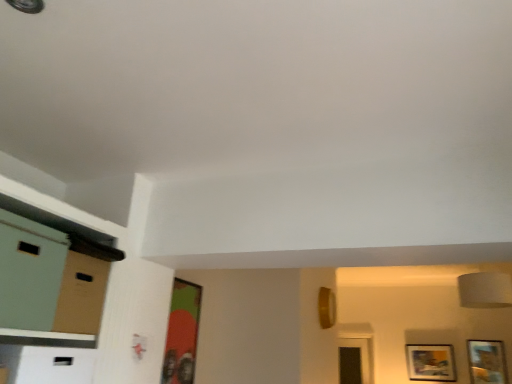
What do you see at coordinates (29, 272) in the screenshot? I see `matte green file cabinet at left` at bounding box center [29, 272].

Locate an element on the screen. The image size is (512, 384). matte cardboard dresser at left is located at coordinates (51, 282).

From a real-world perspective, who is located higher, matte green file cabinet at left or wooden picture frame at lower right, the second picture frame positioned from the right?

matte green file cabinet at left is physically above.

What are the coordinates of `file cabinet in front of the wooden picture frame at lower right, the second picture frame positioned from the right` in the screenshot? It's located at (29, 272).

Can you tell me how much matte green file cabinet at left and wooden picture frame at lower right, arranged as the 1th picture frame when ordered from the bottom, differ in facing direction?

88.4 degrees.

Starting from the matte green file cabinet at left, which picture frame is the 2nd one behind? Please provide its 2D coordinates.

[(487, 362)]

Consider the image. Considering the sizes of objects wooden framed picture at lower right, arranged as the 2th picture frame when viewed from the front, and matte green file cabinet at left in the image provided, who is thinner, wooden framed picture at lower right, arranged as the 2th picture frame when viewed from the front, or matte green file cabinet at left?

With smaller width is wooden framed picture at lower right, arranged as the 2th picture frame when viewed from the front.

In terms of height, does wooden framed picture at lower right, positioned as the 3th picture frame in left-to-right order, look taller or shorter compared to matte green file cabinet at left?

In the image, wooden framed picture at lower right, positioned as the 3th picture frame in left-to-right order, appears to be taller than matte green file cabinet at left.

Is wooden framed picture at lower right, arranged as the 2th picture frame when viewed from the front, outside of matte green file cabinet at left?

Absolutely, wooden framed picture at lower right, arranged as the 2th picture frame when viewed from the front, is external to matte green file cabinet at left.

Between point (485, 342) and point (106, 284), which one is positioned in front?

The point (106, 284) is closer.

Is wooden framed picture at lower right, which is the second picture frame in back-to-front order, looking in the opposite direction of matte cardboard dresser at left?

wooden framed picture at lower right, which is the second picture frame in back-to-front order, is not turned away from matte cardboard dresser at left.

Is wooden framed picture at lower right, positioned as the 2th picture frame in bottom-to-top order, placed right next to matte cardboard dresser at left?

No.

In the image, is wooden framed picture at lower right, positioned as the 2th picture frame in bottom-to-top order, positioned in front of or behind matte cardboard dresser at left?

Clearly, wooden framed picture at lower right, positioned as the 2th picture frame in bottom-to-top order, is behind matte cardboard dresser at left.

Would you say wooden picture frame at lower right, the first picture frame in the back-to-front sequence, is outside matte cardboard dresser at left?

Yes, wooden picture frame at lower right, the first picture frame in the back-to-front sequence, is outside of matte cardboard dresser at left.

Is wooden picture frame at lower right, placed as the 2th picture frame when sorted from left to right, smaller than matte cardboard dresser at left?

Yes.

Considering the sizes of objects wooden picture frame at lower right, which is counted as the 3th picture frame, starting from the front, and matte cardboard dresser at left in the image provided, who is thinner, wooden picture frame at lower right, which is counted as the 3th picture frame, starting from the front, or matte cardboard dresser at left?

With smaller width is wooden picture frame at lower right, which is counted as the 3th picture frame, starting from the front.

How different are the orientations of matte cardboard dresser at left and wooden framed picture at lower right, positioned as the 2th picture frame in bottom-to-top order, in degrees?

There is a 88.4-degree angle between the facing directions of matte cardboard dresser at left and wooden framed picture at lower right, positioned as the 2th picture frame in bottom-to-top order.

Which point is more forward, (6, 294) or (488, 366)?

The point (6, 294) is in front.

Is matte cardboard dresser at left directly adjacent to wooden framed picture at lower right, which is the second picture frame in back-to-front order?

No, matte cardboard dresser at left is not with wooden framed picture at lower right, which is the second picture frame in back-to-front order.

Where is `dresser in front of the wooden framed picture at lower right, positioned as the 3th picture frame in left-to-right order`? This screenshot has width=512, height=384. dresser in front of the wooden framed picture at lower right, positioned as the 3th picture frame in left-to-right order is located at coordinates (51, 282).

There is a matte green file cabinet at left. At what (x,y) coordinates should I click in order to perform the action: click on the 1st picture frame below it (from the image's perspective). Please return your answer as a coordinate pair (x, y). The width and height of the screenshot is (512, 384). Looking at the image, I should click on (182, 333).

From a real-world perspective, is matte green file cabinet at left physically above green matte picture frame at center, the third picture frame from the back?

Yes, from a real-world perspective, matte green file cabinet at left is above green matte picture frame at center, the third picture frame from the back.

Does matte green file cabinet at left come behind green matte picture frame at center, marked as the 1th picture frame in a top-to-bottom arrangement?

No, the depth of matte green file cabinet at left is less than that of green matte picture frame at center, marked as the 1th picture frame in a top-to-bottom arrangement.

Between matte green file cabinet at left and green matte picture frame at center, marked as the 1th picture frame in a top-to-bottom arrangement, which one appears on the right side from the viewer's perspective?

green matte picture frame at center, marked as the 1th picture frame in a top-to-bottom arrangement, is more to the right.

From a real-world perspective, is matte green file cabinet at left physically above matte cardboard dresser at left?

Yes, from a real-world perspective, matte green file cabinet at left is above matte cardboard dresser at left.

Can you confirm if matte green file cabinet at left is smaller than matte cardboard dresser at left?

Incorrect, matte green file cabinet at left is not smaller in size than matte cardboard dresser at left.

From the image's perspective, is matte green file cabinet at left above or below matte cardboard dresser at left?

From the image's perspective, matte green file cabinet at left appears above matte cardboard dresser at left.

There is a matte green file cabinet at left. At what (x,y) coordinates should I click in order to perform the action: click on the 3rd picture frame below it (from a real-world perspective). Please return your answer as a coordinate pair (x, y). The height and width of the screenshot is (384, 512). Looking at the image, I should click on (431, 362).

Where is `the 2nd picture frame behind the matte green file cabinet at left, counting from the anchor's position`? The height and width of the screenshot is (384, 512). the 2nd picture frame behind the matte green file cabinet at left, counting from the anchor's position is located at coordinates (487, 362).

When comparing their distances from matte cardboard dresser at left, does green matte picture frame at center, the first picture frame in the left-to-right sequence, or wooden picture frame at lower right, which is counted as the 3th picture frame, starting from the front, seem closer?

green matte picture frame at center, the first picture frame in the left-to-right sequence, is positioned closer to the anchor matte cardboard dresser at left.

Estimate the real-world distances between objects in this image. Which object is further from green matte picture frame at center, marked as the 3th picture frame in a bottom-to-top arrangement, matte cardboard dresser at left or matte green file cabinet at left?

matte green file cabinet at left.

Looking at the image, which one is located closer to matte cardboard dresser at left, green matte picture frame at center, the third picture frame from the back, or matte green file cabinet at left?

matte green file cabinet at left is closer to matte cardboard dresser at left.

Looking at this image, looking at the image, which one is located further to matte cardboard dresser at left, wooden picture frame at lower right, which is counted as the 3th picture frame, starting from the front, or matte green file cabinet at left?

The object further to matte cardboard dresser at left is wooden picture frame at lower right, which is counted as the 3th picture frame, starting from the front.

When comparing their distances from wooden picture frame at lower right, placed as the 2th picture frame when sorted from left to right, does wooden framed picture at lower right, which appears as the second picture frame when viewed from the top, or green matte picture frame at center, the third picture frame positioned from the right, seem closer?

Based on the image, wooden framed picture at lower right, which appears as the second picture frame when viewed from the top, appears to be nearer to wooden picture frame at lower right, placed as the 2th picture frame when sorted from left to right.

From the image, which object appears to be nearer to wooden framed picture at lower right, which appears as the second picture frame when viewed from the top, green matte picture frame at center, the first picture frame in the left-to-right sequence, or matte cardboard dresser at left?

green matte picture frame at center, the first picture frame in the left-to-right sequence, is positioned closer to the anchor wooden framed picture at lower right, which appears as the second picture frame when viewed from the top.

Considering their positions, is matte cardboard dresser at left positioned further to wooden framed picture at lower right, which appears as the second picture frame when viewed from the top, than green matte picture frame at center, the third picture frame from the back?

matte cardboard dresser at left lies further to wooden framed picture at lower right, which appears as the second picture frame when viewed from the top, than the other object.

Which object lies further to the anchor point green matte picture frame at center, marked as the 1th picture frame in a top-to-bottom arrangement, matte cardboard dresser at left or wooden picture frame at lower right, placed as the 2th picture frame when sorted from left to right?

wooden picture frame at lower right, placed as the 2th picture frame when sorted from left to right, is positioned further to the anchor green matte picture frame at center, marked as the 1th picture frame in a top-to-bottom arrangement.

You are a GUI agent. You are given a task and a screenshot of the screen. Output one action in this format:
    pyautogui.click(x=<x>, y=<y>)
    Task: Click on the dresser between matte green file cabinet at left and green matte picture frame at center, marked as the 3th picture frame in a bottom-to-top arrangement, along the z-axis
    The image size is (512, 384).
    Given the screenshot: What is the action you would take?
    pyautogui.click(x=51, y=282)

This screenshot has width=512, height=384. I want to click on picture frame located between green matte picture frame at center, marked as the 3th picture frame in a bottom-to-top arrangement, and wooden framed picture at lower right, positioned as the 2th picture frame in bottom-to-top order, in the left-right direction, so click(431, 362).

This screenshot has height=384, width=512. Identify the location of dresser between matte green file cabinet at left and wooden picture frame at lower right, which is counted as the 3th picture frame, starting from the front, from front to back. (51, 282).

Locate an element on the screen. Image resolution: width=512 pixels, height=384 pixels. dresser between matte green file cabinet at left and wooden framed picture at lower right, arranged as the 2th picture frame when viewed from the front, along the z-axis is located at coordinates (51, 282).